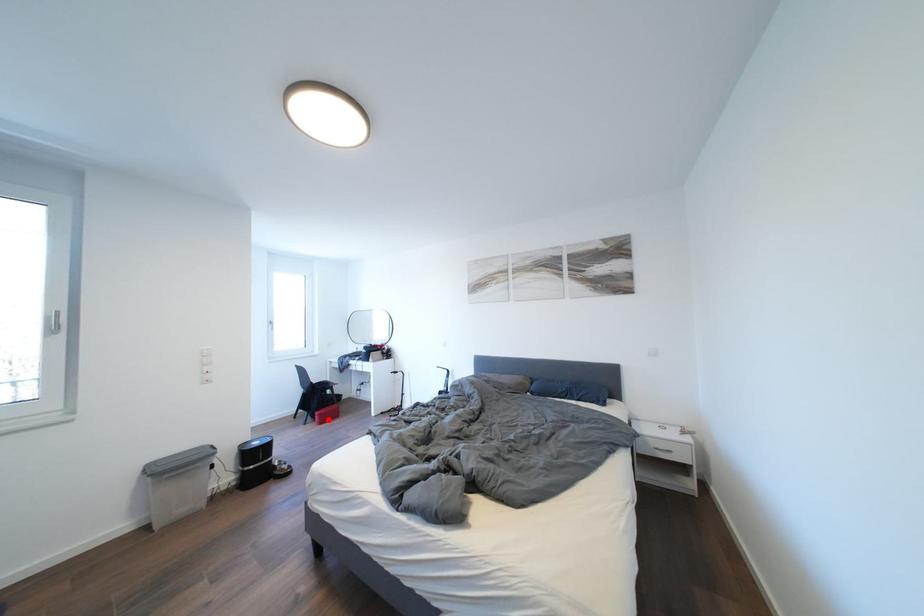
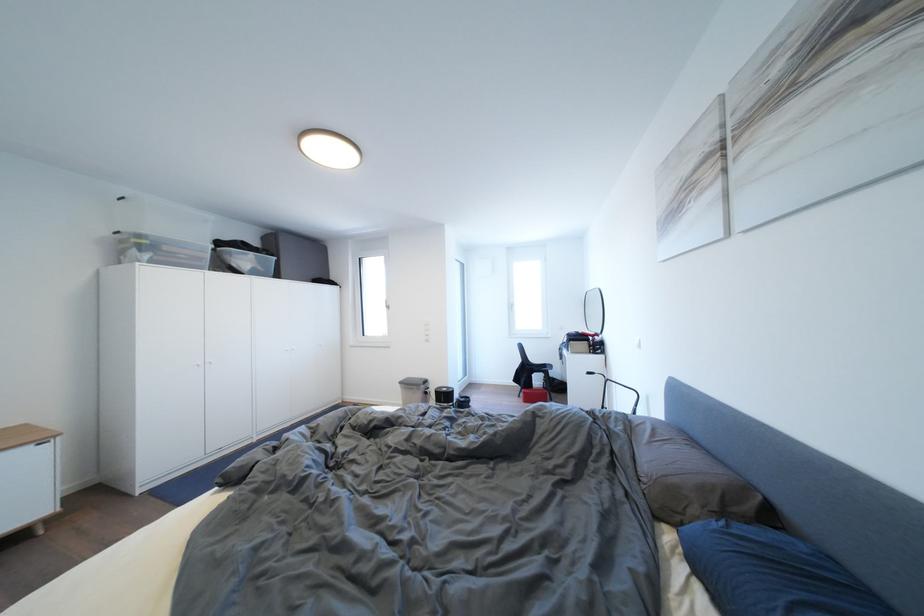
Question: I am providing you with two images of the same scene from different viewpoints. A red point is shown in image1. For the corresponding object point in image2, is it positioned nearer or farther from the camera?

Choices:
 (A) Nearer
 (B) Farther

Answer: (B)